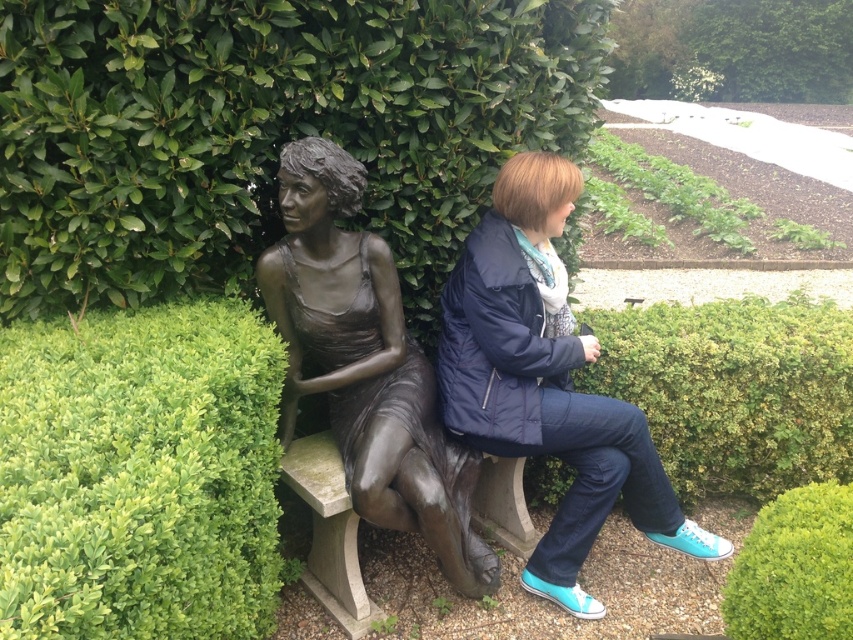
Question: Is green leafy hedge at upper center above green leafy hedge at lower right?

Choices:
 (A) no
 (B) yes

Answer: (B)

Question: Based on their relative distances, which object is nearer to the bronze statue at center?

Choices:
 (A) green leafy hedge at upper left
 (B) matte blue jacket at center

Answer: (B)

Question: Which object is closer to the camera taking this photo?

Choices:
 (A) bronze statue at center
 (B) green leafy hedge at right
 (C) matte blue jacket at center
 (D) green leafy hedge at lower right

Answer: (D)

Question: Is green leafy hedge at center thinner than green leafy hedge at lower right?

Choices:
 (A) yes
 (B) no

Answer: (B)

Question: Based on their relative distances, which object is nearer to the matte blue jacket at center?

Choices:
 (A) bronze statue at center
 (B) green leafy hedge at lower right
 (C) green leafy hedge at upper center
 (D) green leafy hedge at upper left

Answer: (A)

Question: Can you confirm if green leafy hedge at center is positioned below green leafy hedge at right?

Choices:
 (A) no
 (B) yes

Answer: (B)